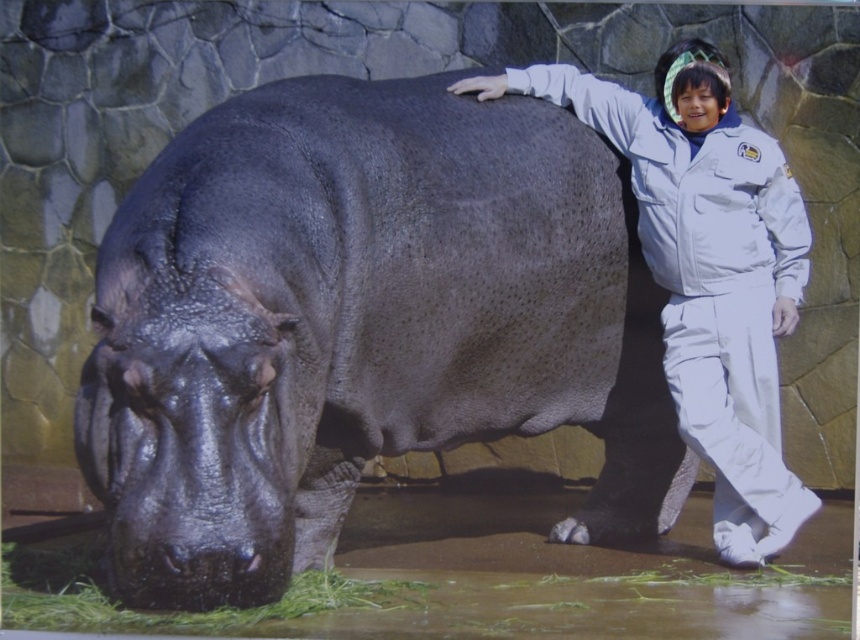
Is shiny dark gray hippo at center positioned behind white matte uniform at right?

No.

Between point (621, 538) and point (774, 536), which one is positioned in front?

Point (774, 536) is in front.

Between point (320, 522) and point (717, 147), which one is positioned in front?

Point (320, 522)

Locate an element on the screen. The height and width of the screenshot is (640, 860). shiny dark gray hippo at center is located at coordinates pos(360,324).